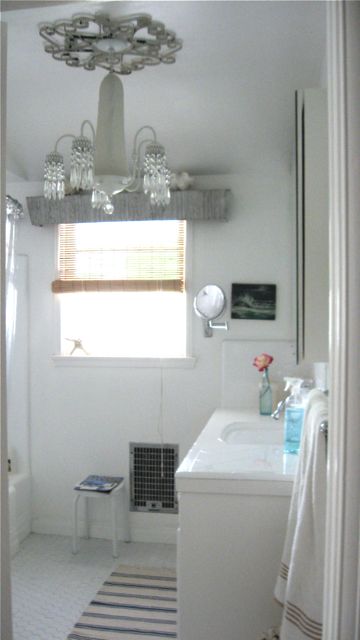
The width and height of the screenshot is (360, 640). What are the coordinates of `vent` in the screenshot? It's located at (148, 473).